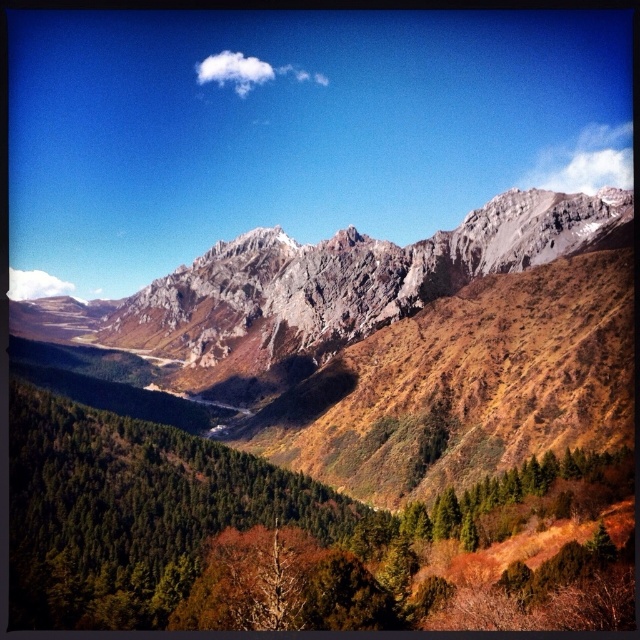
You are an outdoor photographer planning to capture the rocky gray mountains at upper center and the rocky gray mountain range at center in a single shot. Based on their widths, which one should you focus on to ensure it fits entirely within the frame?

The rocky gray mountains at upper center might be wider than the rocky gray mountain range at center, so focusing on the rocky gray mountains at upper center would ensure it fits within the frame.

You are a hiker planning to cross the valley between the rocky gray mountains at upper center and the rocky gray mountain range at center. The path you want to take is 100 feet long. Will the path be long enough to reach the other side?

The distance between the rocky gray mountains at upper center and the rocky gray mountain range at center is 82.08 feet. Since the path is 100 feet long, it will be long enough to reach the other side.